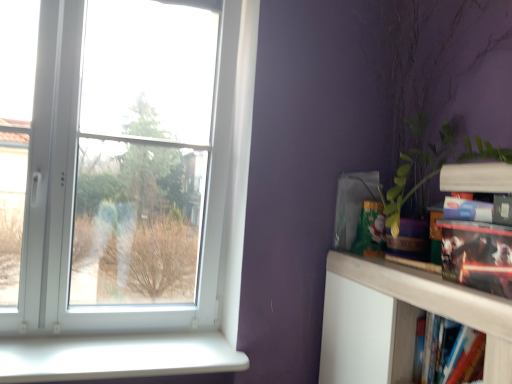
Question: From the image's perspective, is matt black book at right, positioned as the 1th book in top-to-bottom order, under green leafy plant at right?

Choices:
 (A) yes
 (B) no

Answer: (A)

Question: Can you confirm if matt black book at right, the second book in the bottom-to-top sequence, is positioned to the right of green leafy plant at right?

Choices:
 (A) no
 (B) yes

Answer: (B)

Question: Is matt black book at right, positioned as the 1th book in top-to-bottom order, in front of green leafy plant at right?

Choices:
 (A) no
 (B) yes

Answer: (B)

Question: Is matt black book at right, the second book in the bottom-to-top sequence, further to camera compared to green leafy plant at right?

Choices:
 (A) no
 (B) yes

Answer: (A)

Question: From a real-world perspective, is matt black book at right, the second book in the bottom-to-top sequence, positioned under green leafy plant at right based on gravity?

Choices:
 (A) yes
 (B) no

Answer: (A)

Question: Considering the relative positions of matt black book at right, positioned as the 1th book in top-to-bottom order, and green leafy plant at right in the image provided, is matt black book at right, positioned as the 1th book in top-to-bottom order, to the left of green leafy plant at right from the viewer's perspective?

Choices:
 (A) yes
 (B) no

Answer: (B)

Question: Is green leafy plant at right a part of white matte shelf at upper right?

Choices:
 (A) no
 (B) yes

Answer: (A)

Question: Is white matte shelf at upper right positioned with its back to green leafy plant at right?

Choices:
 (A) yes
 (B) no

Answer: (B)

Question: From the image's perspective, is white matte shelf at upper right over green leafy plant at right?

Choices:
 (A) yes
 (B) no

Answer: (B)

Question: Considering the relative sizes of white matte shelf at upper right and green leafy plant at right in the image provided, is white matte shelf at upper right shorter than green leafy plant at right?

Choices:
 (A) no
 (B) yes

Answer: (B)

Question: Can you confirm if white matte shelf at upper right is taller than green leafy plant at right?

Choices:
 (A) yes
 (B) no

Answer: (B)

Question: From a real-world perspective, is white matte shelf at upper right on green leafy plant at right?

Choices:
 (A) yes
 (B) no

Answer: (B)

Question: Can you confirm if white plastic window sill at lower left is taller than white plastic window at upper left?

Choices:
 (A) yes
 (B) no

Answer: (B)